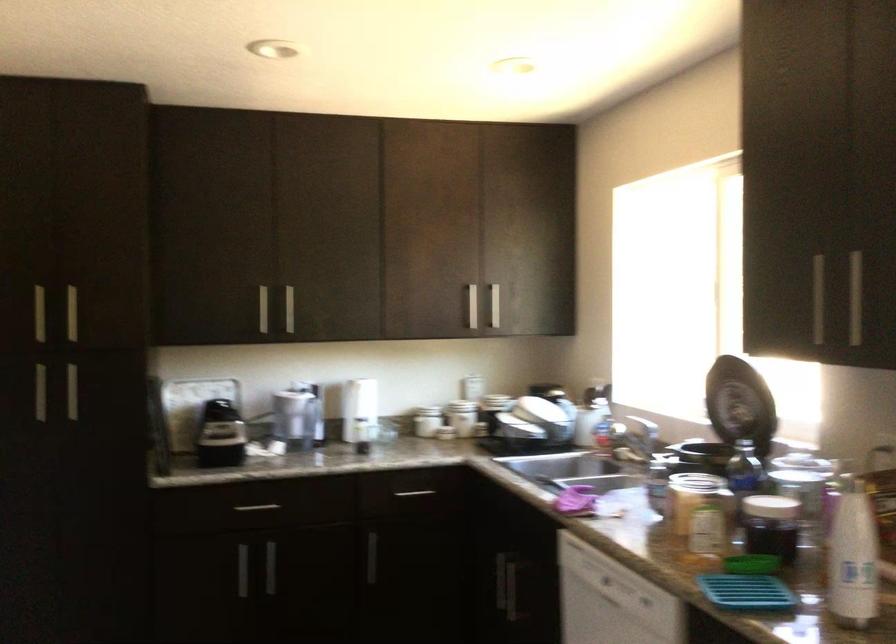
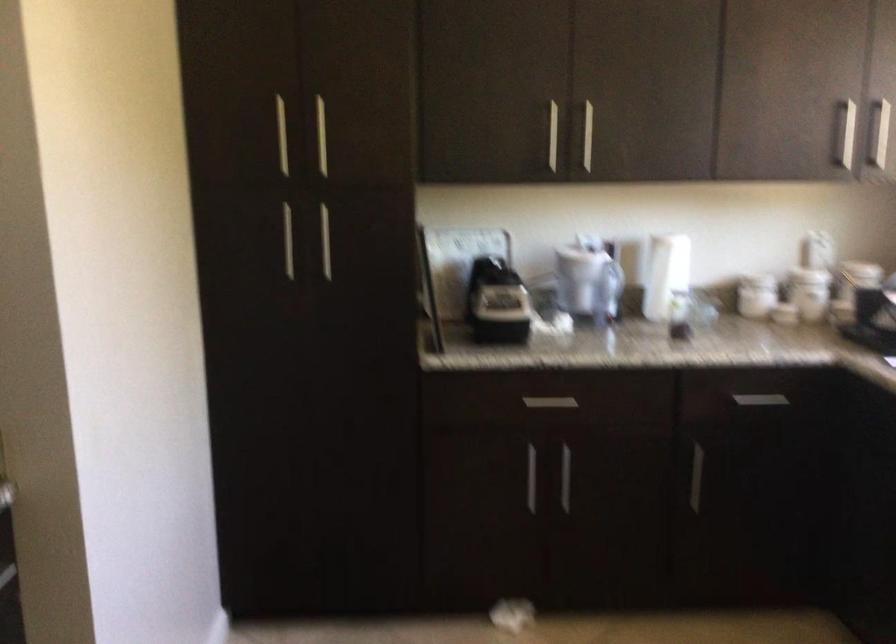
Question: I am providing you with two images of the same scene from different viewpoints. After the viewpoint changes to image2, which objects are now occluded?

Choices:
 (A) silver drawer handle
 (B) white pitcher
 (C) blender pitcher
 (D) none of these

Answer: (D)